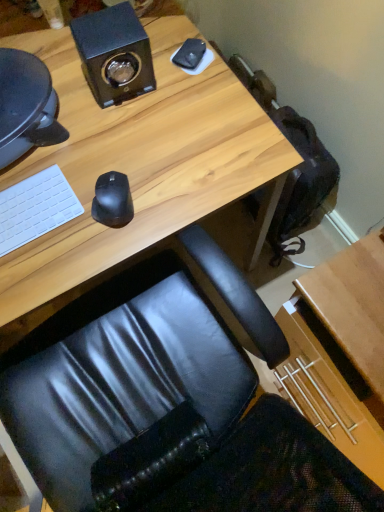
The width and height of the screenshot is (384, 512). I want to click on vacant point above white matte keyboard at left (from a real-world perspective), so click(24, 209).